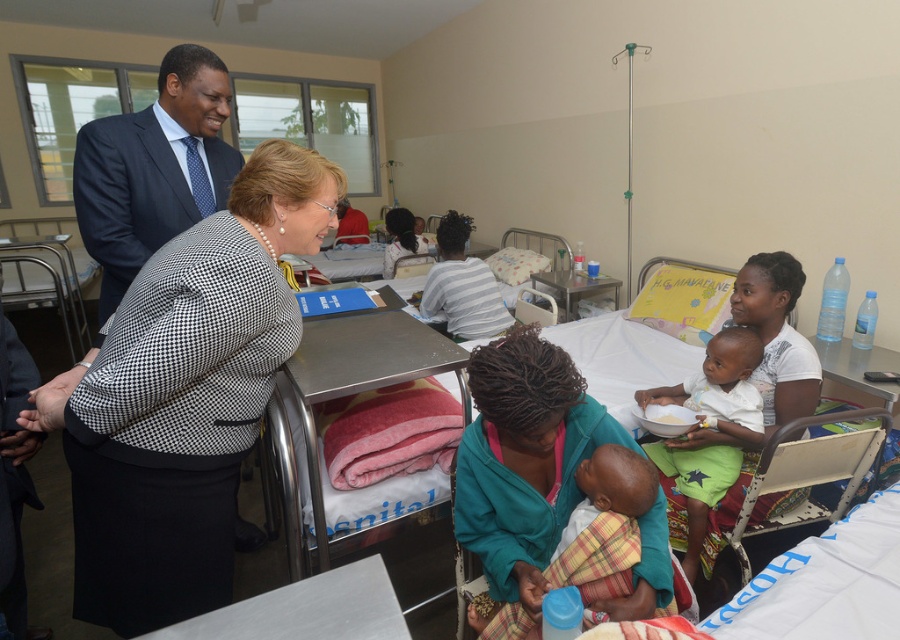
Can you confirm if plaid fabric baby at center is bigger than green cotton shorts at lower right?

Actually, plaid fabric baby at center might be smaller than green cotton shorts at lower right.

Identify the location of plaid fabric baby at center. This screenshot has width=900, height=640. (604, 524).

Is black houndstooth blazer at center above dark blue suit at upper left?

No.

Is black houndstooth blazer at center below dark blue suit at upper left?

Correct, black houndstooth blazer at center is located below dark blue suit at upper left.

Is point (243, 250) positioned in front of point (169, 186)?

Yes.

Locate an element on the screen. The image size is (900, 640). black houndstooth blazer at center is located at coordinates (183, 396).

Between black houndstooth blazer at center and green cotton shorts at lower right, which one has less height?

green cotton shorts at lower right is shorter.

Where is `black houndstooth blazer at center`? The width and height of the screenshot is (900, 640). black houndstooth blazer at center is located at coordinates (183, 396).

The image size is (900, 640). Find the location of `black houndstooth blazer at center`. black houndstooth blazer at center is located at coordinates tap(183, 396).